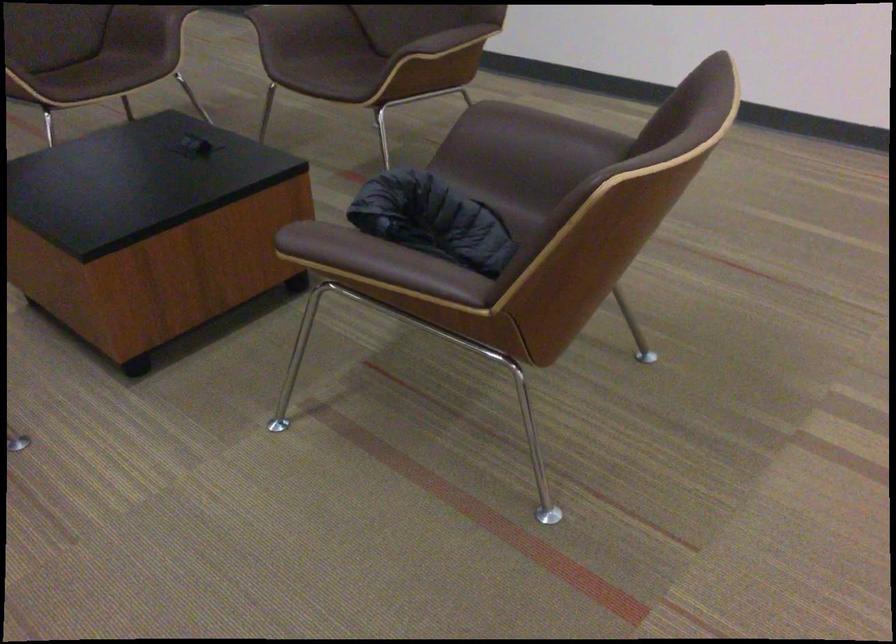
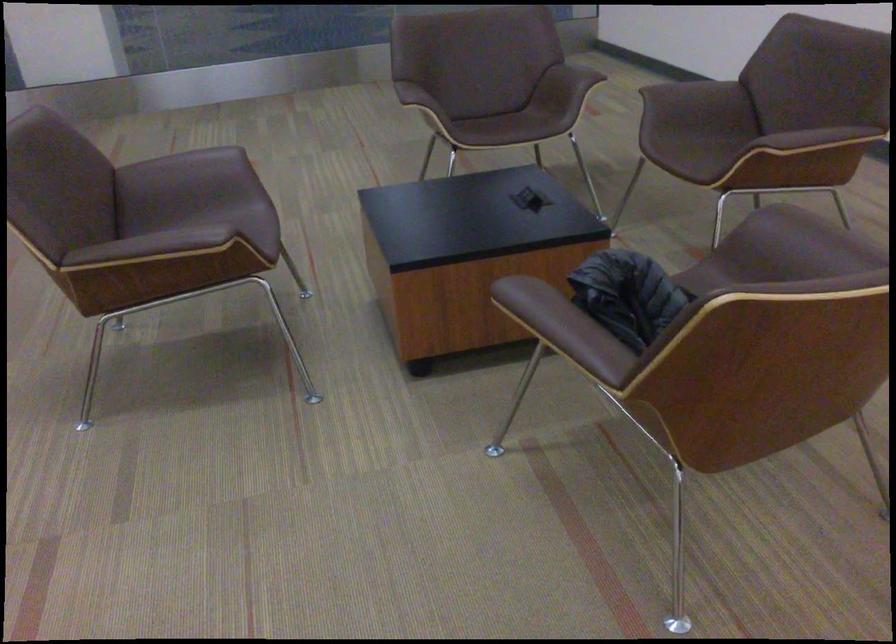
Question: The images are taken continuously from a first-person perspective. In which direction is your viewpoint rotating?

Choices:
 (A) Left
 (B) Right
 (C) Up
 (D) Down

Answer: (A)